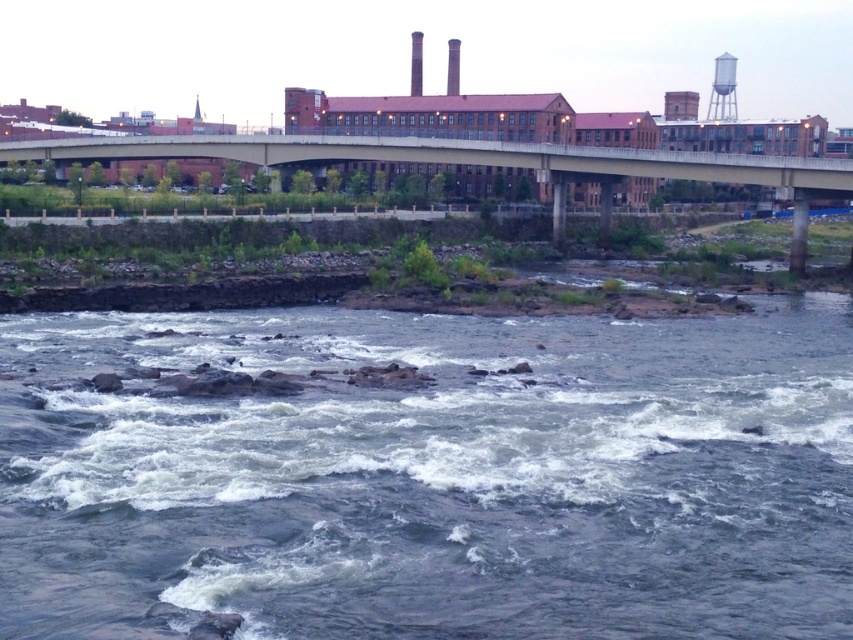
Between point (753, 388) and point (714, 113), which one is positioned in front?

Positioned in front is point (753, 388).

Can you confirm if rough textured water at lower center is positioned to the left of white metallic water tower at upper right?

Correct, you'll find rough textured water at lower center to the left of white metallic water tower at upper right.

What are the coordinates of `rough textured water at lower center` in the screenshot? It's located at (436, 477).

Is point (61, 369) closer to camera compared to point (445, 140)?

Yes.

How distant is rough textured water at lower center from concrete bridge at upper center?

The distance of rough textured water at lower center from concrete bridge at upper center is 55.06 meters.

Is point (33, 508) less distant than point (401, 147)?

That is True.

The image size is (853, 640). Find the location of `rough textured water at lower center`. rough textured water at lower center is located at coordinates (436, 477).

Does concrete bridge at upper center have a larger size compared to white metallic water tower at upper right?

No.

Can you confirm if concrete bridge at upper center is thinner than white metallic water tower at upper right?

No, concrete bridge at upper center is not thinner than white metallic water tower at upper right.

Between point (253, 148) and point (732, 97), which one is positioned behind?

The point (732, 97) is behind.

This screenshot has width=853, height=640. I want to click on concrete bridge at upper center, so [x=482, y=163].